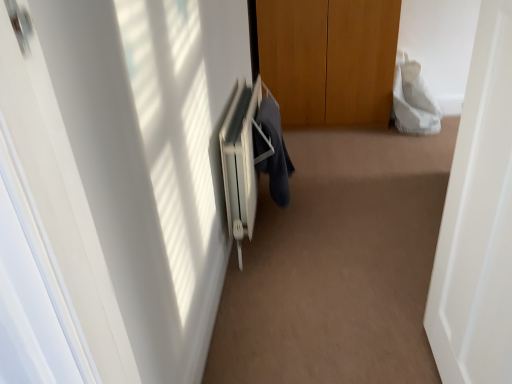
Question: From the image's perspective, is white textured towel at upper right, the second robe ordered from the bottom, beneath white plastic radiator at center?

Choices:
 (A) no
 (B) yes

Answer: (A)

Question: Is white plastic radiator at center located within white textured towel at upper right, the 1th robe in the top-to-bottom sequence?

Choices:
 (A) no
 (B) yes

Answer: (A)

Question: Is there a large distance between white textured towel at upper right, which is the 2th robe from left to right, and white plastic radiator at center?

Choices:
 (A) no
 (B) yes

Answer: (B)

Question: Considering the relative positions of white textured towel at upper right, the 1th robe in the top-to-bottom sequence, and white plastic radiator at center in the image provided, is white textured towel at upper right, the 1th robe in the top-to-bottom sequence, behind white plastic radiator at center?

Choices:
 (A) yes
 (B) no

Answer: (A)

Question: Are white textured towel at upper right, positioned as the first robe in right-to-left order, and white plastic radiator at center beside each other?

Choices:
 (A) no
 (B) yes

Answer: (A)

Question: From the image's perspective, is white plastic radiator at center positioned above or below white matte door at right?

Choices:
 (A) below
 (B) above

Answer: (B)

Question: In terms of size, does white plastic radiator at center appear bigger or smaller than white matte door at right?

Choices:
 (A) small
 (B) big

Answer: (B)

Question: In terms of height, does white plastic radiator at center look taller or shorter compared to white matte door at right?

Choices:
 (A) short
 (B) tall

Answer: (A)

Question: Is white plastic radiator at center inside or outside of white matte door at right?

Choices:
 (A) outside
 (B) inside

Answer: (A)

Question: From their relative heights in the image, would you say white textured towel at upper right, which is the 2th robe from left to right, is taller or shorter than white plastic radiator at center?

Choices:
 (A) tall
 (B) short

Answer: (B)

Question: Looking at their shapes, would you say white textured towel at upper right, the second robe ordered from the bottom, is wider or thinner than white plastic radiator at center?

Choices:
 (A) thin
 (B) wide

Answer: (B)

Question: From a real-world perspective, relative to white plastic radiator at center, is white textured towel at upper right, which is the 2th robe from left to right, vertically above or below?

Choices:
 (A) above
 (B) below

Answer: (B)

Question: In the image, is white textured towel at upper right, which is the 2th robe from left to right, positioned in front of or behind white plastic radiator at center?

Choices:
 (A) behind
 (B) front

Answer: (A)

Question: Does point (401, 94) appear closer or farther from the camera than point (281, 168)?

Choices:
 (A) closer
 (B) farther

Answer: (B)

Question: Is white textured towel at upper right, the 1th robe in the top-to-bottom sequence, inside the boundaries of dark blue fabric at center, the second robe in the right-to-left sequence, or outside?

Choices:
 (A) inside
 (B) outside

Answer: (B)